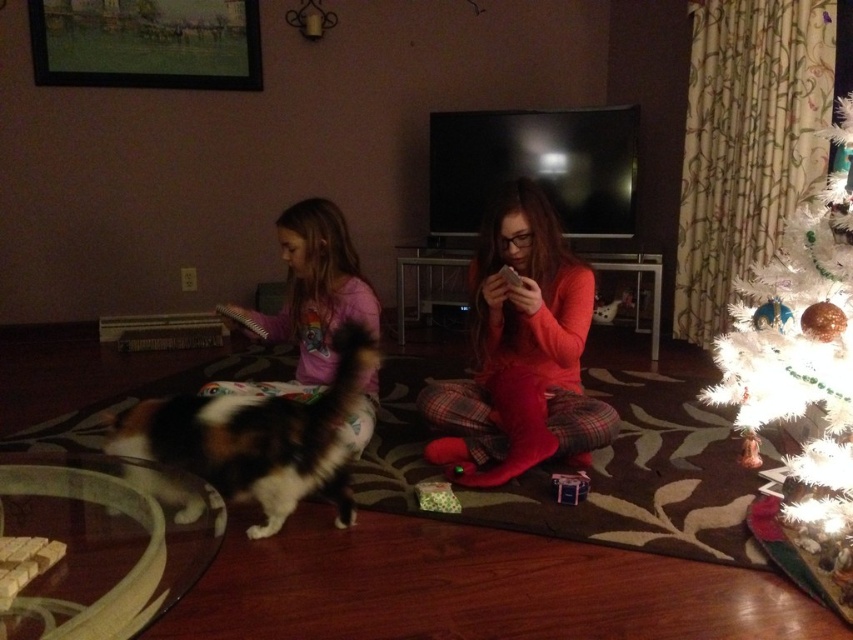
Does matte red pajamas at center appear on the left side of white artificial christmas tree at right?

Indeed, matte red pajamas at center is positioned on the left side of white artificial christmas tree at right.

Which is below, matte red pajamas at center or white artificial christmas tree at right?

white artificial christmas tree at right

Who is more distant from viewer, (474,330) or (753,401)?

Point (474,330)

Identify the location of matte red pajamas at center. (520, 353).

Is matte red pajamas at center below pink fleece pajamas at left?

No, matte red pajamas at center is not below pink fleece pajamas at left.

Does matte red pajamas at center appear on the left side of pink fleece pajamas at left?

No, matte red pajamas at center is not to the left of pink fleece pajamas at left.

Find the location of a particular element. The height and width of the screenshot is (640, 853). matte red pajamas at center is located at coordinates (520, 353).

Looking at this image, can you confirm if white artificial christmas tree at right is shorter than pink fleece pajamas at left?

Incorrect, white artificial christmas tree at right's height does not fall short of pink fleece pajamas at left's.

Is point (728, 365) in front of point (328, 308)?

Yes, point (728, 365) is closer to viewer.

This screenshot has height=640, width=853. In order to click on white artificial christmas tree at right in this screenshot , I will do `click(799, 355)`.

Image resolution: width=853 pixels, height=640 pixels. Identify the location of white artificial christmas tree at right. (799, 355).